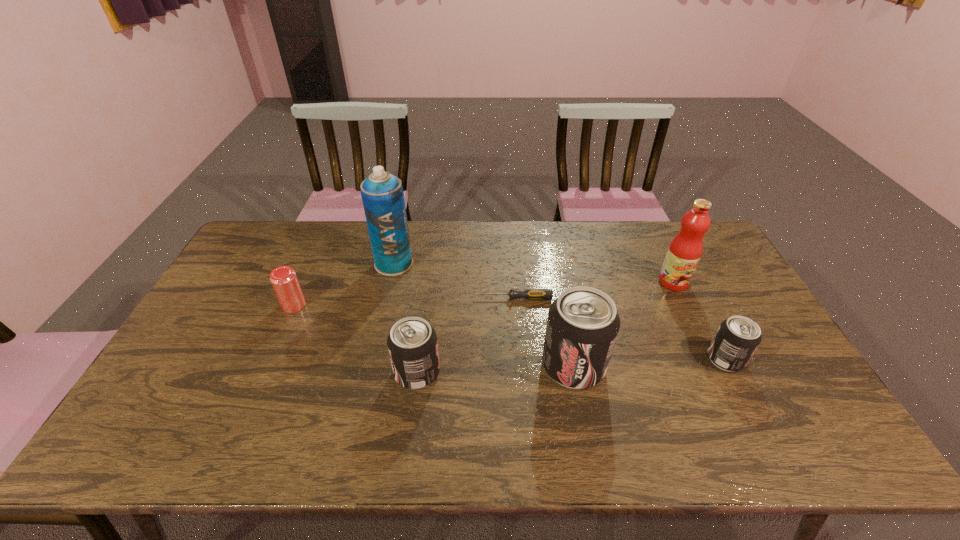
Find the location of a particular element. vacant area between the screwdriver and the aerosol can is located at coordinates (453, 281).

Point out which object is positioned as the fourth nearest to the rightmost soda can. Please provide its 2D coordinates. Your answer should be formatted as a tuple, i.e. [(x, y)], where the tuple contains the x and y coordinates of a point satisfying the conditions above.

[(412, 343)]

This screenshot has width=960, height=540. Find the location of `the fifth closest object to the rightmost soda can`. the fifth closest object to the rightmost soda can is located at coordinates (382, 194).

Identify the location of soda can that is the second closest to the beer can. (582, 326).

Image resolution: width=960 pixels, height=540 pixels. In order to click on the closest soda can to the leftmost object in this screenshot , I will do `click(412, 343)`.

Where is `vacant area in the image that satisfies the following two spatial constraints: 1. insert the shortest object into a screw head; 2. on the right side of the tallest soda can`? vacant area in the image that satisfies the following two spatial constraints: 1. insert the shortest object into a screw head; 2. on the right side of the tallest soda can is located at coordinates (518, 366).